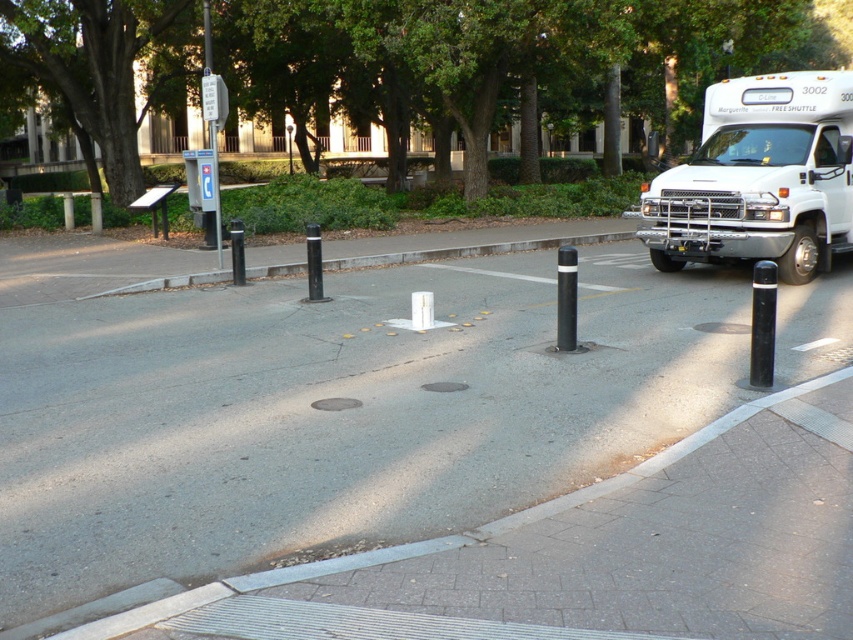
You are a delivery person with a cart that is 2 meters long. You need to park your cart near the white matte shuttle bus at upper right. Can you park your cart within 15 meters of the shuttle bus?

The white matte shuttle bus at upper right is 13.73 meters away from viewer. Since your cart is 2 meters long, parking within 15 meters is possible as 13.73 meters is less than 15 meters.